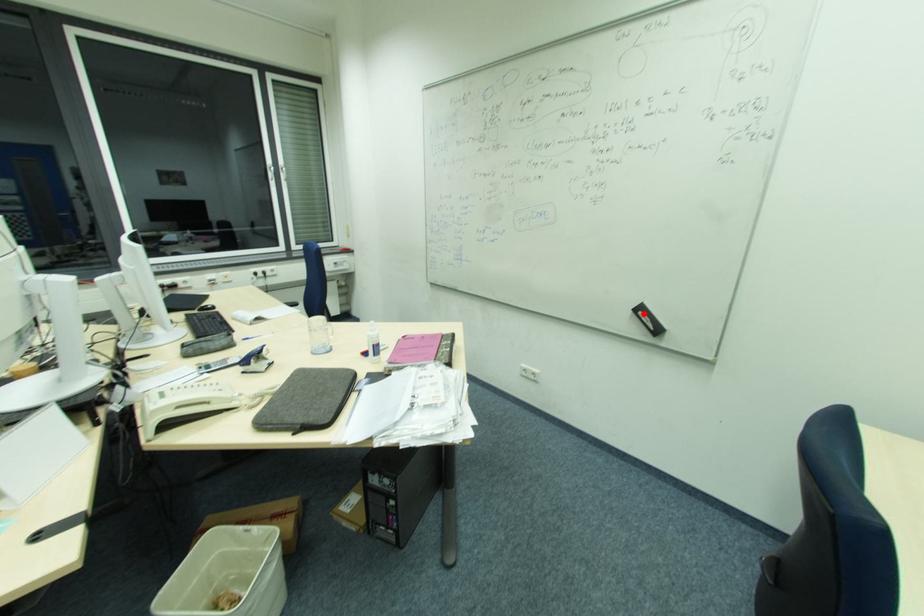
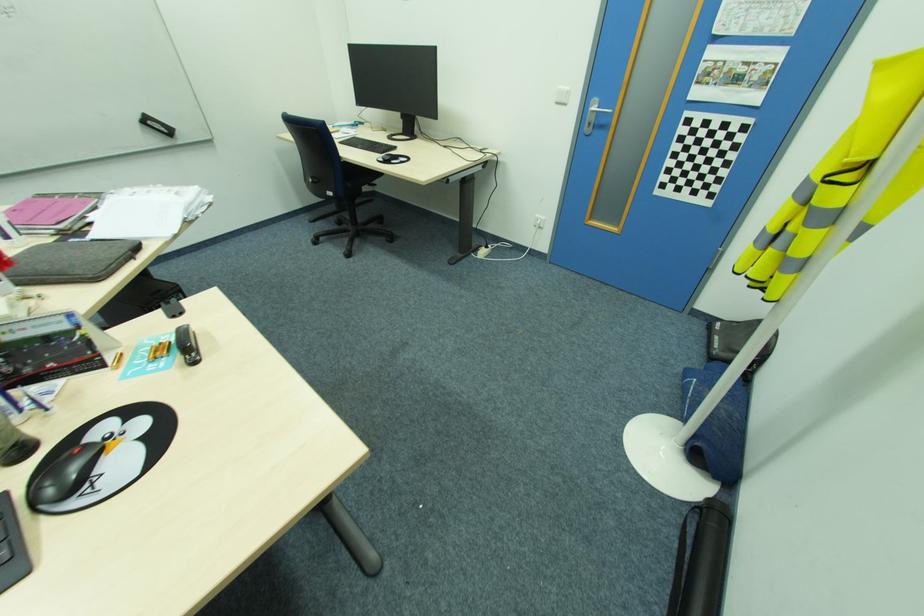
Where in the second image is the point corresponding to the highlighted location from the first image?

(151, 123)